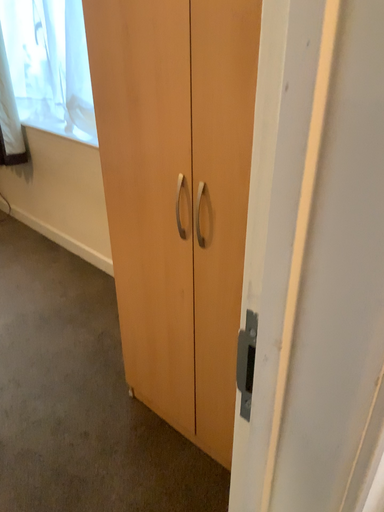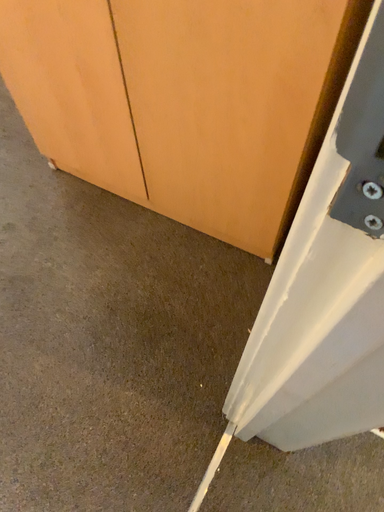
Question: Which way did the camera rotate in the video?

Choices:
 (A) rotated left
 (B) rotated right

Answer: (B)